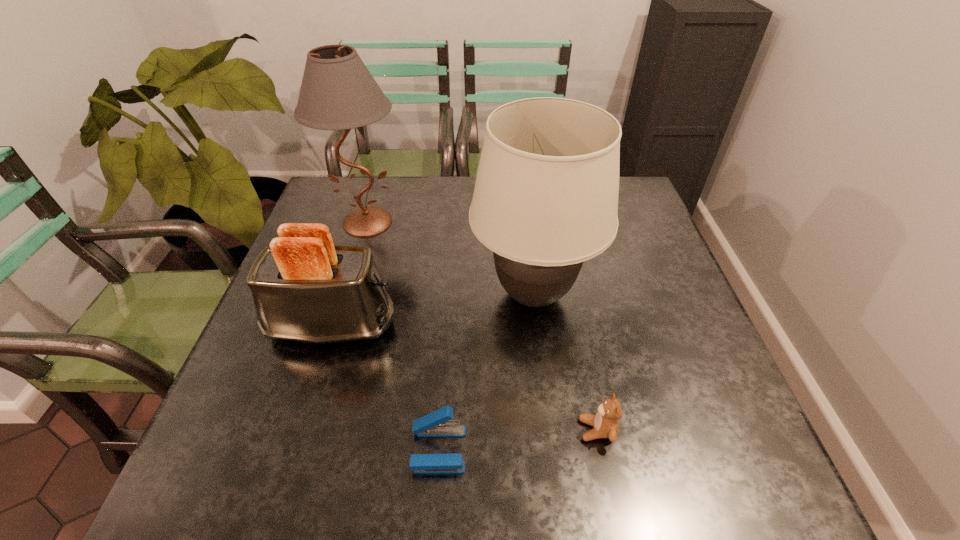
At what (x,y) coordinates should I click in order to perform the action: click on table lamp. Please return your answer as a coordinate pair (x, y). Looking at the image, I should click on pyautogui.click(x=338, y=92).

Where is `lampshade`? The image size is (960, 540). lampshade is located at coordinates 545,200.

You are a GUI agent. You are given a task and a screenshot of the screen. Output one action in this format:
    pyautogui.click(x=<x>, y=<y>)
    Task: Click on the third tallest object
    
    Given the screenshot: What is the action you would take?
    pyautogui.click(x=306, y=289)

The width and height of the screenshot is (960, 540). Find the location of `the fourth tallest object`. the fourth tallest object is located at coordinates (606, 421).

This screenshot has width=960, height=540. In order to click on the third object from right to left in this screenshot , I will do `click(436, 424)`.

At what (x,y) coordinates should I click in order to perform the action: click on stapler. Please return your answer as a coordinate pair (x, y). This screenshot has height=540, width=960. Looking at the image, I should click on (436, 424).

Find the location of a particular element. vacant space situated 0.350m on the front-facing side of the farthest object is located at coordinates (328, 352).

The height and width of the screenshot is (540, 960). I want to click on vacant space located 0.230m on the front of the lampshade, so click(x=551, y=448).

You are a GUI agent. You are given a task and a screenshot of the screen. Output one action in this format:
    pyautogui.click(x=<x>, y=<y>)
    Task: Click on the free location located on the side of the toaster with the control lever
    
    Given the screenshot: What is the action you would take?
    pyautogui.click(x=506, y=325)

Locate an element on the screen. This screenshot has width=960, height=540. vacant area situated on the front-facing side of the teddy bear is located at coordinates (521, 430).